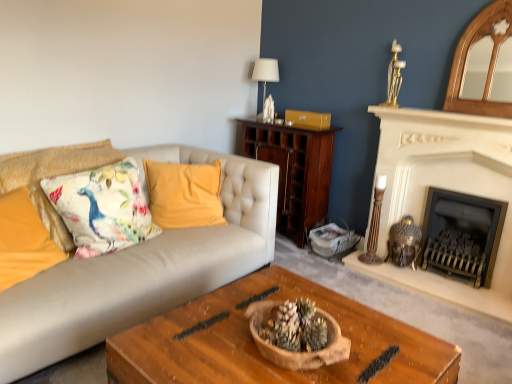
The width and height of the screenshot is (512, 384). Describe the element at coordinates (53, 176) in the screenshot. I see `floral fabric cushion at left, the second pillow when ordered from left to right` at that location.

The height and width of the screenshot is (384, 512). What do you see at coordinates (462, 235) in the screenshot?
I see `black metal fireplace at right, which is counted as the 2th fireplace, starting from the left` at bounding box center [462, 235].

Locate an element on the screen. This screenshot has height=384, width=512. wooden bowl at center is located at coordinates (257, 348).

The image size is (512, 384). What do you see at coordinates (257, 348) in the screenshot? I see `wooden bowl at center` at bounding box center [257, 348].

The width and height of the screenshot is (512, 384). Describe the element at coordinates (266, 72) in the screenshot. I see `white fabric lampshade at upper center` at that location.

The height and width of the screenshot is (384, 512). Find the location of `floral fabric cushion at left`. floral fabric cushion at left is located at coordinates (102, 208).

You are a GUI agent. You are given a task and a screenshot of the screen. Output one action in this format:
    pyautogui.click(x=<x>, y=<y>)
    Task: Click on the gold metallic candle holder at upper right, acting as the second candle holder starting from the bottom
    This screenshot has height=384, width=512.
    Given the screenshot: What is the action you would take?
    pyautogui.click(x=394, y=77)

Based on their positions, is black metal fireplace at right, the 1th fireplace viewed from the right, located to the left or right of floral fabric cushion at left?

black metal fireplace at right, the 1th fireplace viewed from the right, is to the right of floral fabric cushion at left.

Is black metal fireplace at right, the 1th fireplace viewed from the right, in front of or behind floral fabric cushion at left in the image?

In the image, black metal fireplace at right, the 1th fireplace viewed from the right, appears behind floral fabric cushion at left.

Based on the photo, can you tell me how much black metal fireplace at right, the 1th fireplace viewed from the right, and floral fabric cushion at left differ in facing direction?

They differ by 88.8 degrees in their facing directions.

Can you confirm if black metal fireplace at right, the 1th fireplace viewed from the right, is wider than floral fabric cushion at left?

In fact, black metal fireplace at right, the 1th fireplace viewed from the right, might be narrower than floral fabric cushion at left.

From the image's perspective, does wooden candle holder at right, the second candle holder positioned from the top, appear higher than white fabric lampshade at upper center?

No, from the image's perspective, wooden candle holder at right, the second candle holder positioned from the top, is not over white fabric lampshade at upper center.

Does wooden candle holder at right, the second candle holder positioned from the top, have a greater height compared to white fabric lampshade at upper center?

Correct, wooden candle holder at right, the second candle holder positioned from the top, is much taller as white fabric lampshade at upper center.

Considering the sizes of wooden candle holder at right, the second candle holder positioned from the top, and white fabric lampshade at upper center in the image, is wooden candle holder at right, the second candle holder positioned from the top, bigger or smaller than white fabric lampshade at upper center?

wooden candle holder at right, the second candle holder positioned from the top, is smaller than white fabric lampshade at upper center.

Is floral fabric cushion at left, which appears as the 2th pillow when viewed from the right, thinner than white stone fireplace at right, arranged as the 2th fireplace when viewed from the right?

In fact, floral fabric cushion at left, which appears as the 2th pillow when viewed from the right, might be wider than white stone fireplace at right, arranged as the 2th fireplace when viewed from the right.

Considering the sizes of objects floral fabric cushion at left, the second pillow when ordered from left to right, and white stone fireplace at right, positioned as the 1th fireplace in left-to-right order, in the image provided, who is bigger, floral fabric cushion at left, the second pillow when ordered from left to right, or white stone fireplace at right, positioned as the 1th fireplace in left-to-right order,?

Bigger between the two is floral fabric cushion at left, the second pillow when ordered from left to right.

Is gold metallic candle holder at upper right, acting as the second candle holder starting from the bottom, surrounded by floral fabric cushion at left, the second pillow when ordered from left to right?

No, gold metallic candle holder at upper right, acting as the second candle holder starting from the bottom, is not surrounded by floral fabric cushion at left, the second pillow when ordered from left to right.

Which candle holder is the 2nd one when counting from the back of the floral fabric cushion at left, the second pillow when ordered from left to right? Please provide its 2D coordinates.

[(394, 77)]

From the picture: From a real-world perspective, is floral fabric cushion at left, the second pillow when ordered from left to right, on top of gold metallic candle holder at upper right, which is the first candle holder in top-to-bottom order?

No.

From the image's perspective, is floral fabric cushion at left, which appears as the 2th pillow when viewed from the right, above gold metallic candle holder at upper right, acting as the second candle holder starting from the bottom?

No, from the image's perspective, floral fabric cushion at left, which appears as the 2th pillow when viewed from the right, is not on top of gold metallic candle holder at upper right, acting as the second candle holder starting from the bottom.

Does gold metallic candle holder at upper right, acting as the second candle holder starting from the bottom, have a larger size compared to wooden candle holder at right, placed as the first candle holder when sorted from bottom to top?

No, gold metallic candle holder at upper right, acting as the second candle holder starting from the bottom, is not bigger than wooden candle holder at right, placed as the first candle holder when sorted from bottom to top.

Consider the image. Who is shorter, gold metallic candle holder at upper right, which is the first candle holder in top-to-bottom order, or wooden candle holder at right, the second candle holder positioned from the top?

With less height is gold metallic candle holder at upper right, which is the first candle holder in top-to-bottom order.

From a real-world perspective, between gold metallic candle holder at upper right, acting as the second candle holder starting from the bottom, and wooden candle holder at right, the second candle holder positioned from the top, who is vertically lower?

wooden candle holder at right, the second candle holder positioned from the top, from a real-world perspective.

Is gold metallic candle holder at upper right, acting as the second candle holder starting from the bottom, to the right of wooden candle holder at right, the second candle holder positioned from the top, from the viewer's perspective?

Correct, you'll find gold metallic candle holder at upper right, acting as the second candle holder starting from the bottom, to the right of wooden candle holder at right, the second candle holder positioned from the top.

From a real-world perspective, is black metal fireplace at right, the 1th fireplace viewed from the right, located beneath velvet yellow pillow at center, which is the 1th pillow from right to left?

Indeed, from a real-world perspective, black metal fireplace at right, the 1th fireplace viewed from the right, is positioned beneath velvet yellow pillow at center, which is the 1th pillow from right to left.

Looking at this image, from the image's perspective, is black metal fireplace at right, which is counted as the 2th fireplace, starting from the left, positioned above or below velvet yellow pillow at center, which is the 1th pillow from right to left?

From the image's perspective, black metal fireplace at right, which is counted as the 2th fireplace, starting from the left, appears below velvet yellow pillow at center, which is the 1th pillow from right to left.

In the scene shown: What's the angular difference between black metal fireplace at right, the 1th fireplace viewed from the right, and velvet yellow pillow at center, the 3th pillow when ordered from left to right,'s facing directions?

49.1 degrees.

In terms of height, does black metal fireplace at right, the 1th fireplace viewed from the right, look taller or shorter compared to velvet yellow pillow at center, the 3th pillow when ordered from left to right?

Clearly, black metal fireplace at right, the 1th fireplace viewed from the right, is shorter compared to velvet yellow pillow at center, the 3th pillow when ordered from left to right.

Does white fabric lampshade at upper center turn towards floral fabric cushion at left?

Yes.

Considering the positions of objects white fabric lampshade at upper center and floral fabric cushion at left in the image provided, who is more to the left, white fabric lampshade at upper center or floral fabric cushion at left?

floral fabric cushion at left.

Can you confirm if white fabric lampshade at upper center is thinner than floral fabric cushion at left?

Correct, the width of white fabric lampshade at upper center is less than that of floral fabric cushion at left.

Which is behind, point (278, 74) or point (131, 198)?

Positioned behind is point (278, 74).

The height and width of the screenshot is (384, 512). I want to click on fireplace that is the 2nd object located behind the floral fabric cushion at left, so click(462, 235).

The image size is (512, 384). Find the location of `lamp on the left of wooden candle holder at right, the second candle holder positioned from the top`. lamp on the left of wooden candle holder at right, the second candle holder positioned from the top is located at coordinates (266, 72).

From the image, which object appears to be nearer to floral fabric cushion at left, the third pillow from the right, white stone fireplace at right, arranged as the 2th fireplace when viewed from the right, or floral fabric cushion at left, the second pillow when ordered from left to right?

floral fabric cushion at left, the second pillow when ordered from left to right, lies closer to floral fabric cushion at left, the third pillow from the right, than the other object.

Looking at the image, which one is located further to wooden candle holder at right, placed as the first candle holder when sorted from bottom to top, wooden bowl at center or velvet yellow pillow at center, the 3th pillow when ordered from left to right?

wooden bowl at center lies further to wooden candle holder at right, placed as the first candle holder when sorted from bottom to top, than the other object.

From the picture: Looking at the image, which one is located further to gold metallic candle holder at upper right, which is the first candle holder in top-to-bottom order, wooden bowl at center or black metal fireplace at right, which is counted as the 2th fireplace, starting from the left?

wooden bowl at center is further to gold metallic candle holder at upper right, which is the first candle holder in top-to-bottom order.

From the image, which object appears to be farther from black metal fireplace at right, which is counted as the 2th fireplace, starting from the left, velvet yellow pillow at center, the 3th pillow when ordered from left to right, or floral fabric cushion at left?

The object further to black metal fireplace at right, which is counted as the 2th fireplace, starting from the left, is floral fabric cushion at left.

Based on their spatial positions, is white stone fireplace at right, positioned as the 1th fireplace in left-to-right order, or floral fabric cushion at left closer to wooden candle holder at right, placed as the first candle holder when sorted from bottom to top?

The object closer to wooden candle holder at right, placed as the first candle holder when sorted from bottom to top, is white stone fireplace at right, positioned as the 1th fireplace in left-to-right order.

Consider the image. Which object lies nearer to the anchor point wooden candle holder at right, placed as the first candle holder when sorted from bottom to top, floral fabric cushion at left, which appears as the 2th pillow when viewed from the right, or wooden bowl at center?

wooden bowl at center is closer to wooden candle holder at right, placed as the first candle holder when sorted from bottom to top.

When comparing their distances from wooden bowl at center, does gold metallic candle holder at upper right, acting as the second candle holder starting from the bottom, or floral fabric cushion at left seem closer?

floral fabric cushion at left is closer to wooden bowl at center.

Based on their spatial positions, is floral fabric cushion at left, the third pillow from the right, or wooden bowl at center further from velvet yellow pillow at center, which is the 1th pillow from right to left?

wooden bowl at center.

Where is `throw pillow located between wooden bowl at center and gold metallic candle holder at upper right, acting as the second candle holder starting from the bottom, in the depth direction`? The height and width of the screenshot is (384, 512). throw pillow located between wooden bowl at center and gold metallic candle holder at upper right, acting as the second candle holder starting from the bottom, in the depth direction is located at coordinates (102, 208).

Identify the location of pillow located between floral fabric cushion at left and wooden candle holder at right, the second candle holder positioned from the top, in the left-right direction. This screenshot has width=512, height=384. (184, 194).

Where is `lamp located between floral fabric cushion at left and black metal fireplace at right, which is counted as the 2th fireplace, starting from the left, in the left-right direction`? Image resolution: width=512 pixels, height=384 pixels. lamp located between floral fabric cushion at left and black metal fireplace at right, which is counted as the 2th fireplace, starting from the left, in the left-right direction is located at coordinates (266, 72).

Identify the location of throw pillow situated between floral fabric cushion at left, which appears as the 2th pillow when viewed from the right, and wooden candle holder at right, the second candle holder positioned from the top, from left to right. This screenshot has height=384, width=512. (102, 208).